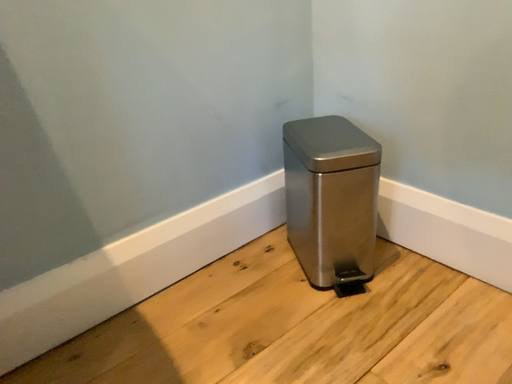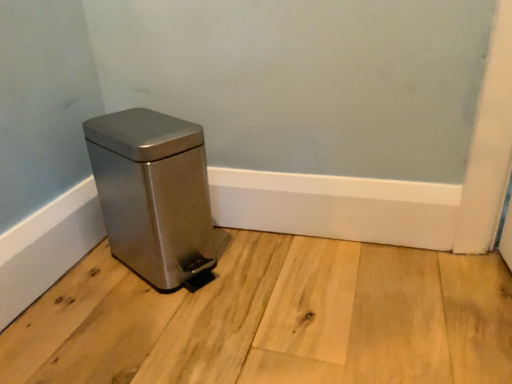
Question: Which way did the camera rotate in the video?

Choices:
 (A) rotated right
 (B) rotated left

Answer: (A)